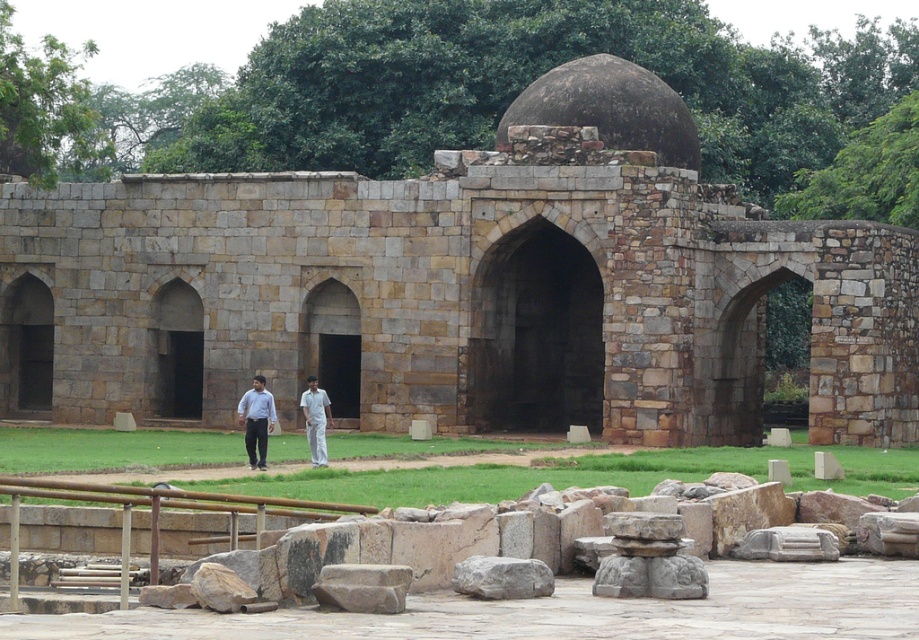
Who is more distant from viewer, (536, 561) or (316, 416)?

Positioned behind is point (316, 416).

Can you confirm if gray rough stone at center is wider than white cotton shirt at center?

Incorrect, gray rough stone at center's width does not surpass white cotton shirt at center's.

Image resolution: width=919 pixels, height=640 pixels. In order to click on gray rough stone at center in this screenshot , I will do `click(502, 577)`.

Which is more to the right, light blue shirt at center or white cotton shirt at center?

Positioned to the right is white cotton shirt at center.

Who is more distant from viewer, [240,412] or [320,394]?

Positioned behind is point [240,412].

Find the location of a particular element. The height and width of the screenshot is (640, 919). light blue shirt at center is located at coordinates (256, 420).

Is brown stone archway at center positioned before gray rough stone at center?

No, brown stone archway at center is behind gray rough stone at center.

At what (x,y) coordinates should I click in order to perform the action: click on brown stone archway at center. Please return your answer as a coordinate pair (x, y). This screenshot has height=640, width=919. Looking at the image, I should click on (461, 288).

Where is `brown stone archway at center`? Image resolution: width=919 pixels, height=640 pixels. brown stone archway at center is located at coordinates (461, 288).